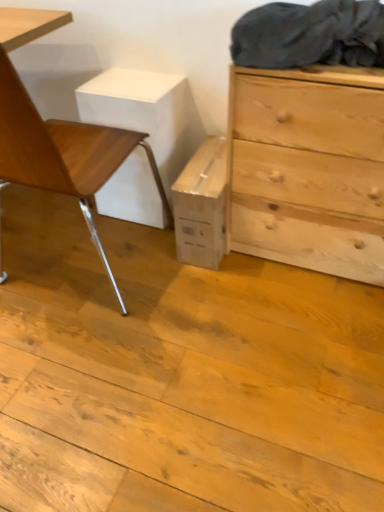
The width and height of the screenshot is (384, 512). I want to click on vacant region in front of wooden chair at left, so click(91, 375).